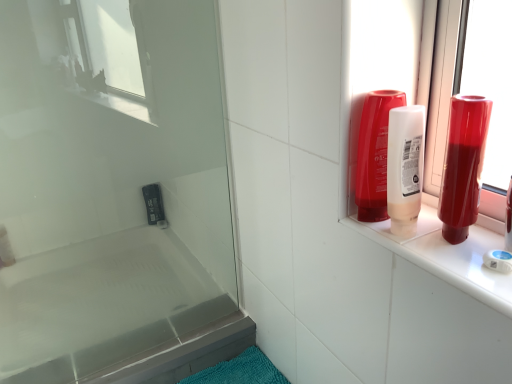
What do you see at coordinates (374, 154) in the screenshot? This screenshot has width=512, height=384. I see `translucent plastic mouthwash at upper right, which appears as the second mouthwash when viewed from the right` at bounding box center [374, 154].

Where is `white glossy bathtub at lower left`? white glossy bathtub at lower left is located at coordinates (113, 312).

Based on the photo, do you think transparent glass screen door at upper left is within translucent plastic soap at lower left, or outside of it?

transparent glass screen door at upper left lies outside translucent plastic soap at lower left.

Is transparent glass screen door at upper left bigger or smaller than translucent plastic soap at lower left?

In the image, transparent glass screen door at upper left appears to be larger than translucent plastic soap at lower left.

Who is shorter, transparent glass screen door at upper left or translucent plastic soap at lower left?

translucent plastic soap at lower left.

Looking at this image, how different are the orientations of transparent glass screen door at upper left and translucent plastic soap at lower left in degrees?

transparent glass screen door at upper left and translucent plastic soap at lower left are facing 1.52 degrees away from each other.

From the image's perspective, is shiny red bottle at right, the first mouthwash viewed from the right, above white glossy bathtub at lower left?

Correct, shiny red bottle at right, the first mouthwash viewed from the right, appears higher than white glossy bathtub at lower left in the image.

From a real-world perspective, is shiny red bottle at right, which ranks as the second mouthwash in left-to-right order, physically below white glossy bathtub at lower left?

Incorrect, from a real-world perspective, shiny red bottle at right, which ranks as the second mouthwash in left-to-right order, is higher than white glossy bathtub at lower left.

Would you say white glossy bathtub at lower left is part of shiny red bottle at right, which ranks as the second mouthwash in left-to-right order,'s contents?

Definitely not — white glossy bathtub at lower left is not inside shiny red bottle at right, which ranks as the second mouthwash in left-to-right order.

From a real-world perspective, relative to white glossy bathtub at lower left, is translucent plastic mouthwash at upper right, which appears as the second mouthwash when viewed from the right, vertically above or below?

From a real-world perspective, translucent plastic mouthwash at upper right, which appears as the second mouthwash when viewed from the right, is physically above white glossy bathtub at lower left.

Which of these two, translucent plastic mouthwash at upper right, the 1th mouthwash when ordered from left to right, or white glossy bathtub at lower left, is wider?

With larger width is white glossy bathtub at lower left.

Which point is more distant from viewer, (384,151) or (63,256)?

Positioned behind is point (63,256).

Who is bigger, translucent plastic soap at lower left or transparent glass screen door at upper left?

Bigger between the two is transparent glass screen door at upper left.

Does translucent plastic soap at lower left have a greater height compared to transparent glass screen door at upper left?

No, translucent plastic soap at lower left is not taller than transparent glass screen door at upper left.

Is translucent plastic soap at lower left far from transparent glass screen door at upper left?

They are positioned close to each other.

Considering the points (78, 130) and (360, 179), which point is in front, point (78, 130) or point (360, 179)?

The point (360, 179) is closer.

Which of these two, transparent glass screen door at upper left or translucent plastic mouthwash at upper right, the 1th mouthwash when ordered from left to right, stands shorter?

translucent plastic mouthwash at upper right, the 1th mouthwash when ordered from left to right.

Is transparent glass screen door at upper left inside the boundaries of translucent plastic mouthwash at upper right, the 1th mouthwash when ordered from left to right, or outside?

transparent glass screen door at upper left is spatially situated outside translucent plastic mouthwash at upper right, the 1th mouthwash when ordered from left to right.

In the scene shown: From a real-world perspective, between transparent glass screen door at upper left and translucent plastic mouthwash at upper right, the 1th mouthwash when ordered from left to right, who is vertically higher?

In real-world perspective, translucent plastic mouthwash at upper right, the 1th mouthwash when ordered from left to right, is above.

Is translucent plastic soap at lower left thinner than translucent plastic mouthwash at upper right, the 1th mouthwash when ordered from left to right?

Indeed, translucent plastic soap at lower left has a lesser width compared to translucent plastic mouthwash at upper right, the 1th mouthwash when ordered from left to right.

Does translucent plastic soap at lower left have a lesser height compared to translucent plastic mouthwash at upper right, which appears as the second mouthwash when viewed from the right?

Indeed, translucent plastic soap at lower left has a lesser height compared to translucent plastic mouthwash at upper right, which appears as the second mouthwash when viewed from the right.

Can we say translucent plastic soap at lower left lies outside translucent plastic mouthwash at upper right, which appears as the second mouthwash when viewed from the right?

Yes, translucent plastic soap at lower left is outside of translucent plastic mouthwash at upper right, which appears as the second mouthwash when viewed from the right.

What's the angular difference between white glossy bathtub at lower left and shiny red bottle at right, which ranks as the second mouthwash in left-to-right order,'s facing directions?

white glossy bathtub at lower left and shiny red bottle at right, which ranks as the second mouthwash in left-to-right order, are facing 0.448 degrees away from each other.

Is white glossy bathtub at lower left bigger than shiny red bottle at right, which ranks as the second mouthwash in left-to-right order?

Yes.

What are the coordinates of `bathtub behind the shiny red bottle at right, which ranks as the second mouthwash in left-to-right order` in the screenshot? It's located at (113, 312).

Between white glossy bathtub at lower left and shiny red bottle at right, the first mouthwash viewed from the right, which one has less height?

white glossy bathtub at lower left is shorter.

At what (x,y) coordinates should I click in order to perform the action: click on screen door above the translucent plastic soap at lower left (from a real-world perspective). Please return your answer as a coordinate pair (x, y). The height and width of the screenshot is (384, 512). Looking at the image, I should click on (114, 193).

Find the location of a particular element. the 2nd mouthwash counting from the right of the white glossy bathtub at lower left is located at coordinates (463, 165).

Looking at the image, which one is located closer to translucent plastic soap at lower left, white glossy bathtub at lower left or translucent plastic mouthwash at upper right, which appears as the second mouthwash when viewed from the right?

white glossy bathtub at lower left is closer to translucent plastic soap at lower left.

Considering their positions, is translucent plastic mouthwash at upper right, which appears as the second mouthwash when viewed from the right, positioned closer to translucent plastic soap at lower left than shiny red bottle at right, the first mouthwash viewed from the right?

translucent plastic mouthwash at upper right, which appears as the second mouthwash when viewed from the right, lies closer to translucent plastic soap at lower left than the other object.

From the image, which object appears to be farther from shiny red bottle at right, the first mouthwash viewed from the right, transparent glass screen door at upper left or white glossy bathtub at lower left?

Based on the image, white glossy bathtub at lower left appears to be further to shiny red bottle at right, the first mouthwash viewed from the right.

Estimate the real-world distances between objects in this image. Which object is closer to shiny red bottle at right, which ranks as the second mouthwash in left-to-right order, white glossy bathtub at lower left or translucent plastic mouthwash at upper right, which appears as the second mouthwash when viewed from the right?

translucent plastic mouthwash at upper right, which appears as the second mouthwash when viewed from the right, is closer to shiny red bottle at right, which ranks as the second mouthwash in left-to-right order.

Estimate the real-world distances between objects in this image. Which object is further from translucent plastic soap at lower left, transparent glass screen door at upper left or translucent plastic mouthwash at upper right, the 1th mouthwash when ordered from left to right?

Among the two, translucent plastic mouthwash at upper right, the 1th mouthwash when ordered from left to right, is located further to translucent plastic soap at lower left.

From the image, which object appears to be nearer to translucent plastic soap at lower left, white glossy bathtub at lower left or transparent glass screen door at upper left?

Among the two, transparent glass screen door at upper left is located nearer to translucent plastic soap at lower left.

From the image, which object appears to be farther from transparent glass screen door at upper left, translucent plastic soap at lower left or translucent plastic mouthwash at upper right, which appears as the second mouthwash when viewed from the right?

The object further to transparent glass screen door at upper left is translucent plastic mouthwash at upper right, which appears as the second mouthwash when viewed from the right.

Based on the photo, looking at the image, which one is located closer to white glossy bathtub at lower left, translucent plastic mouthwash at upper right, the 1th mouthwash when ordered from left to right, or transparent glass screen door at upper left?

The object closer to white glossy bathtub at lower left is transparent glass screen door at upper left.

At what (x,y) coordinates should I click in order to perform the action: click on mouthwash between transparent glass screen door at upper left and shiny red bottle at right, which ranks as the second mouthwash in left-to-right order, in the horizontal direction. Please return your answer as a coordinate pair (x, y). Looking at the image, I should click on (374, 154).

You are a GUI agent. You are given a task and a screenshot of the screen. Output one action in this format:
    pyautogui.click(x=<x>, y=<y>)
    Task: Click on the mouthwash located between white glossy bathtub at lower left and shiny red bottle at right, which ranks as the second mouthwash in left-to-right order, in the left-right direction
    
    Given the screenshot: What is the action you would take?
    pyautogui.click(x=374, y=154)

Image resolution: width=512 pixels, height=384 pixels. Identify the location of screen door between white glossy bathtub at lower left and shiny red bottle at right, which ranks as the second mouthwash in left-to-right order, in the horizontal direction. (114, 193).

Find the location of a particular element. The height and width of the screenshot is (384, 512). mouthwash situated between translucent plastic soap at lower left and shiny red bottle at right, which ranks as the second mouthwash in left-to-right order, from left to right is located at coordinates (374, 154).